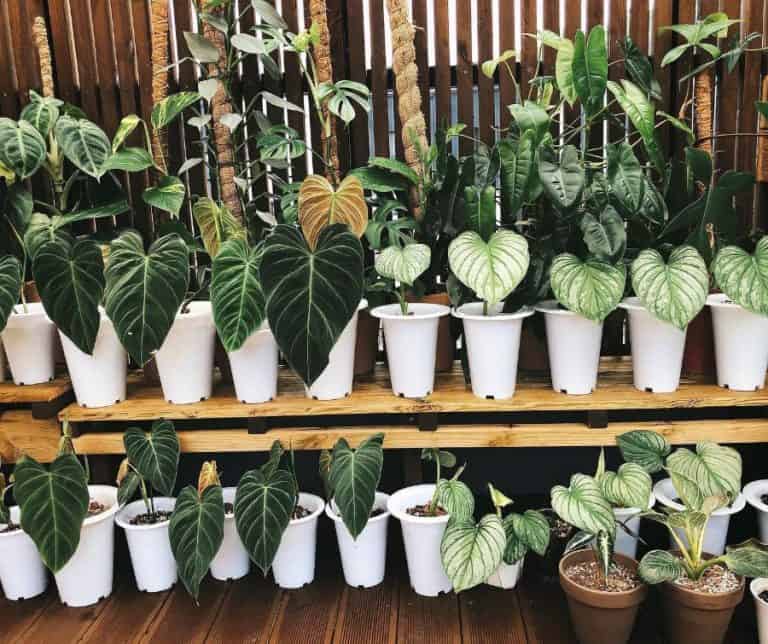
This screenshot has width=768, height=644. Identify the location of pot. (189, 366).